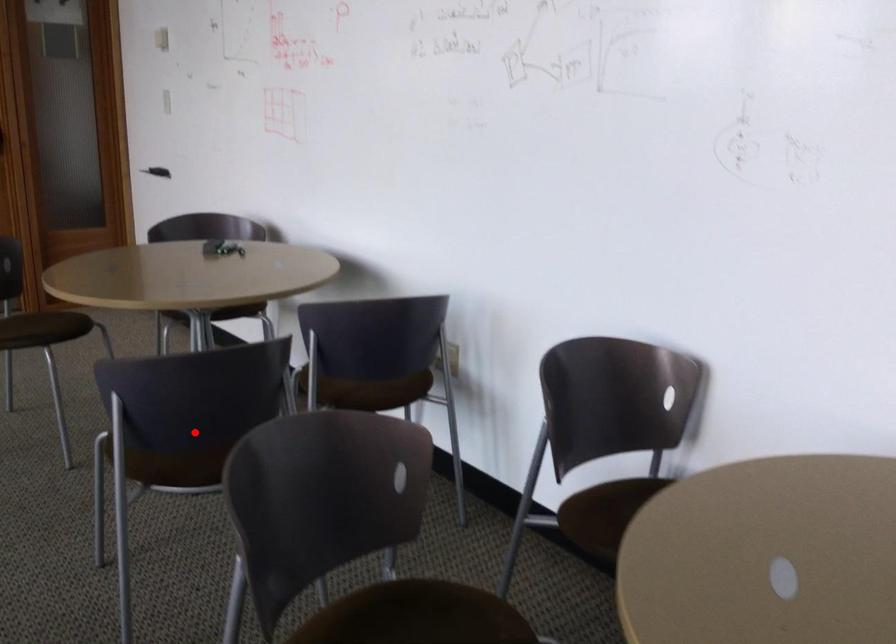
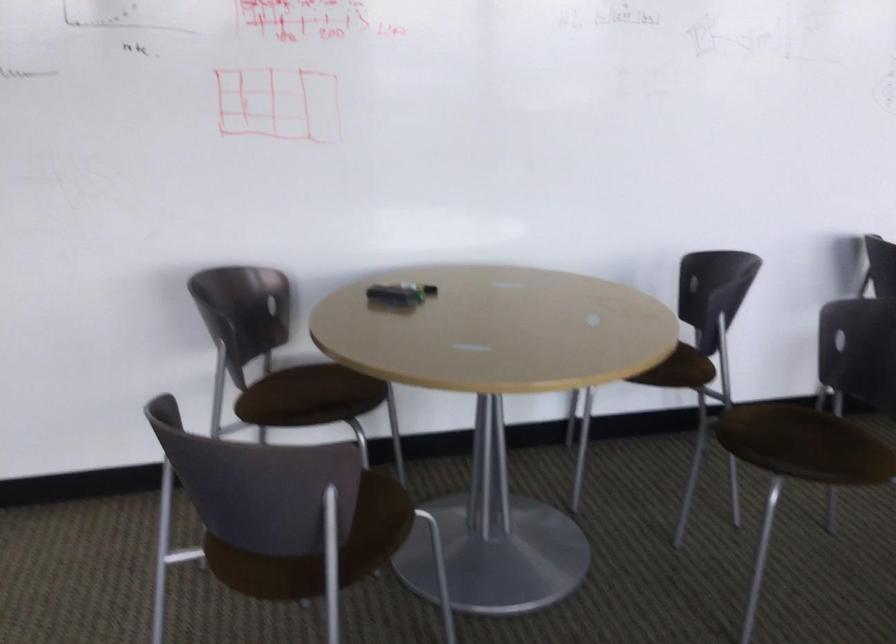
In the second image, find the point that corresponds to the highlighted location in the first image.

(798, 437)